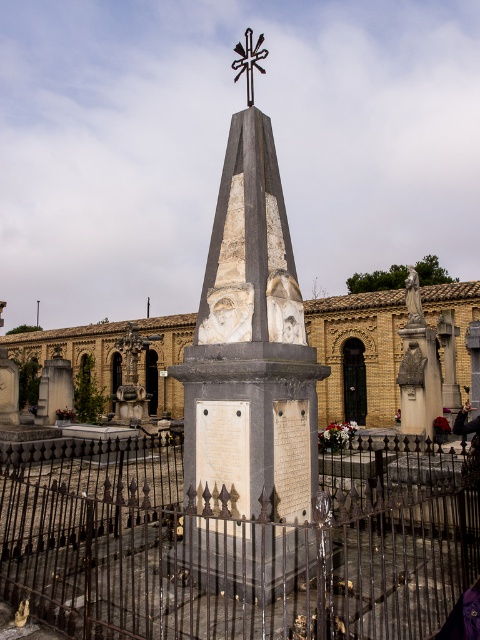
You are a historian visiting the cemetery and want to take a photo of both the white marble bust at center and the metallic cross at center. Which object should you focus on first if you want to include both in the frame without zooming in or out?

The white marble bust at center has a smaller width than the metallic cross at center, so you should focus on the metallic cross at center first to ensure both fit in the frame.

You are a visitor at the cemetery and want to take a photo of the black wrought iron fence at center and the matte stone statue at right. You need to ensure both are fully visible in the frame. Based on their heights, which object might require you to adjust your camera angle to capture its full height?

The matte stone statue at right is taller than the black wrought iron fence at center, so you might need to adjust your camera angle to capture its full height.

In the scene shown: You are standing in the cemetery looking at the obelisk monument. There are two points marked in the image. Which point, point (268,291) or point (244,70), is closer to your current position?

Point (268,291) is closer to the camera than point (244,70), so it is closer to your current position.